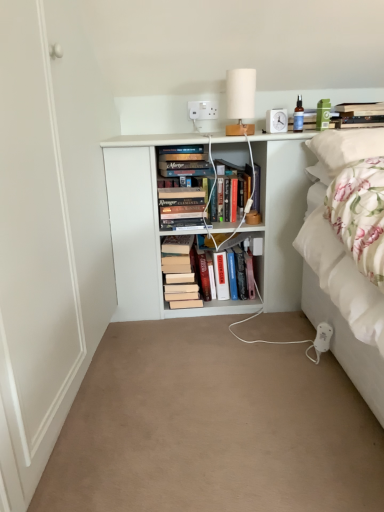
Looking at this image, measure the distance between point (249, 99) and camera.

Point (249, 99) is 5.92 feet from camera.

The width and height of the screenshot is (384, 512). What do you see at coordinates (240, 99) in the screenshot?
I see `white fabric lampshade at upper center` at bounding box center [240, 99].

This screenshot has height=512, width=384. What do you see at coordinates (203, 110) in the screenshot? I see `white plastic socket at upper center` at bounding box center [203, 110].

Identify the location of white plastic socket at upper center. pos(203,110).

This screenshot has height=512, width=384. What are the coordinates of `white soft pillow at upper right` in the screenshot? It's located at (346, 146).

At what (x,y) coordinates should I click in order to perform the action: click on hardcover book at upper right, the third book from the bottom. Please return your answer as a coordinate pair (x, y). The image size is (384, 512). Looking at the image, I should click on (360, 115).

Describe the element at coordinates (230, 303) in the screenshot. I see `hardcover book at center, the second book ordered from the bottom` at that location.

Find the location of a particular element. white fabric lampshade at upper center is located at coordinates click(240, 99).

Could you tell me if white matte bookshelf at center is facing white soft pillow at upper right?

Yes, white matte bookshelf at center is facing white soft pillow at upper right.

Is white matte bookshelf at center behind white soft pillow at upper right?

Yes, white matte bookshelf at center is further from the viewer.

Is white matte bookshelf at center to the left of white soft pillow at upper right from the viewer's perspective?

Correct, you'll find white matte bookshelf at center to the left of white soft pillow at upper right.

Find the location of a particular element. book below the hardcover book at center, the second book ordered from the bottom (from the image's perspective) is located at coordinates (179, 273).

Is hardcover book at center, the second book ordered from the bottom, at the back of hardcover books at center, marked as the third book in a right-to-left arrangement?

No, hardcover books at center, marked as the third book in a right-to-left arrangement,'s orientation is not away from hardcover book at center, the second book ordered from the bottom.

Can we say hardcover books at center, which ranks as the first book in left-to-right order, lies outside hardcover book at center, the 2th book positioned from the left?

Yes, hardcover books at center, which ranks as the first book in left-to-right order, is not within hardcover book at center, the 2th book positioned from the left.

From the image's perspective, is hardcover books at center, which ranks as the first book in left-to-right order, above or below hardcover book at center, the 2th book positioned from the left?

Clearly, from the image's perspective, hardcover books at center, which ranks as the first book in left-to-right order, is below hardcover book at center, the 2th book positioned from the left.

From the picture: Between white plastic socket at upper center and white soft pillow at upper right, which one has smaller size?

white plastic socket at upper center is smaller.

From a real-world perspective, who is located higher, white plastic socket at upper center or white soft pillow at upper right?

In real-world perspective, white plastic socket at upper center is above.

Who is taller, white plastic socket at upper center or white soft pillow at upper right?

white soft pillow at upper right is taller.

How many degrees apart are the facing directions of white fabric lampshade at upper center and white soft pillow at upper right?

The angular difference between white fabric lampshade at upper center and white soft pillow at upper right is 0.00147 degrees.

Based on the photo, relative to white soft pillow at upper right, is white fabric lampshade at upper center in front or behind?

Visually, white fabric lampshade at upper center is located behind white soft pillow at upper right.

Considering the relative sizes of white fabric lampshade at upper center and white soft pillow at upper right in the image provided, is white fabric lampshade at upper center bigger than white soft pillow at upper right?

Incorrect, white fabric lampshade at upper center is not larger than white soft pillow at upper right.

Is the position of white plastic socket at upper center less distant than that of beige carpet at center?

No, white plastic socket at upper center is further to the viewer.

Can beige carpet at center be found inside white plastic socket at upper center?

No, white plastic socket at upper center does not contain beige carpet at center.

Can you confirm if white plastic socket at upper center is smaller than beige carpet at center?

Correct, white plastic socket at upper center occupies less space than beige carpet at center.

Looking at this image, from the image's perspective, is white plastic socket at upper center positioned above or below beige carpet at center?

white plastic socket at upper center is above beige carpet at center.

From a real-world perspective, relative to beige carpet at center, is white soft pillow at upper right vertically above or below?

white soft pillow at upper right is above beige carpet at center.

From the picture: Does white soft pillow at upper right lie behind beige carpet at center?

Yes, the depth of white soft pillow at upper right is greater than that of beige carpet at center.

The width and height of the screenshot is (384, 512). I want to click on pillow that appears on the right of beige carpet at center, so click(346, 146).

Considering the sizes of objects white soft pillow at upper right and beige carpet at center in the image provided, who is taller, white soft pillow at upper right or beige carpet at center?

white soft pillow at upper right.

Does white fabric lampshade at upper center have a lesser height compared to white matte bookshelf at center?

Yes, white fabric lampshade at upper center is shorter than white matte bookshelf at center.

Which is nearer, (238, 114) or (174, 142)?

The point (174, 142) is more forward.

From a real-world perspective, which object stands above the other?

white fabric lampshade at upper center is physically above.

From the image's perspective, is white fabric lampshade at upper center positioned above or below white matte bookshelf at center?

Based on their image positions, white fabric lampshade at upper center is located above white matte bookshelf at center.

Identify the location of pillow that appears above the white matte bookshelf at center (from a real-world perspective). (346, 146).

Where is `book below the hardcover book at center, the second book ordered from the bottom (from the image's perspective)`? The height and width of the screenshot is (512, 384). book below the hardcover book at center, the second book ordered from the bottom (from the image's perspective) is located at coordinates (179, 273).

In the scene shown: Estimate the real-world distances between objects in this image. Which object is further from hardcover book at center, the second book in the top-to-bottom sequence, white matte bookshelf at center or white fabric lampshade at upper center?

white fabric lampshade at upper center lies further to hardcover book at center, the second book in the top-to-bottom sequence, than the other object.

In the scene shown: Based on their spatial positions, is white plastic socket at upper center or hardcover books at center, the 3th book when ordered from top to bottom, further from white matte bookshelf at center?

white plastic socket at upper center.

Looking at the image, which one is located closer to white soft pillow at upper right, white plastic socket at upper center or white fabric lampshade at upper center?

Based on the image, white fabric lampshade at upper center appears to be nearer to white soft pillow at upper right.

Based on the photo, considering their positions, is hardcover books at center, marked as the third book in a right-to-left arrangement, positioned closer to hardcover book at upper right, positioned as the 1th book in top-to-bottom order, than white fabric lampshade at upper center?

Based on the image, white fabric lampshade at upper center appears to be nearer to hardcover book at upper right, positioned as the 1th book in top-to-bottom order.

Looking at the image, which one is located further to white soft pillow at upper right, hardcover books at center, the 3th book when ordered from top to bottom, or white plastic socket at upper center?

hardcover books at center, the 3th book when ordered from top to bottom, is positioned further to the anchor white soft pillow at upper right.

Which object lies further to the anchor point hardcover book at upper right, which ranks as the first book in right-to-left order, beige carpet at center or white plastic socket at upper center?

beige carpet at center lies further to hardcover book at upper right, which ranks as the first book in right-to-left order, than the other object.

From the image, which object appears to be nearer to white fabric lampshade at upper center, white matte bookshelf at center or hardcover book at center, which ranks as the second book in right-to-left order?

white matte bookshelf at center.

Based on their spatial positions, is hardcover books at center, which appears as the first book when ordered from the bottom, or hardcover book at upper right, positioned as the 1th book in top-to-bottom order, closer to hardcover book at center, the second book in the top-to-bottom sequence?

Based on the image, hardcover books at center, which appears as the first book when ordered from the bottom, appears to be nearer to hardcover book at center, the second book in the top-to-bottom sequence.

Where is `shelf between white fabric lampshade at upper center and hardcover books at center, marked as the third book in a right-to-left arrangement, vertically`? shelf between white fabric lampshade at upper center and hardcover books at center, marked as the third book in a right-to-left arrangement, vertically is located at coordinates (136, 223).

The height and width of the screenshot is (512, 384). In order to click on shelf that lies between hardcover book at upper right, the third book from the bottom, and hardcover book at center, the second book ordered from the bottom, from top to bottom in this screenshot , I will do `click(136, 223)`.

Find the location of a particular element. The width and height of the screenshot is (384, 512). shelf between hardcover books at center, marked as the third book in a right-to-left arrangement, and hardcover book at upper right, the third book from the bottom is located at coordinates (136, 223).

You are a GUI agent. You are given a task and a screenshot of the screen. Output one action in this format:
    pyautogui.click(x=<x>, y=<y>)
    Task: Click on the shelf positioned between white soft pillow at upper right and white plastic socket at upper center from near to far
    The image size is (384, 512).
    Given the screenshot: What is the action you would take?
    pyautogui.click(x=136, y=223)